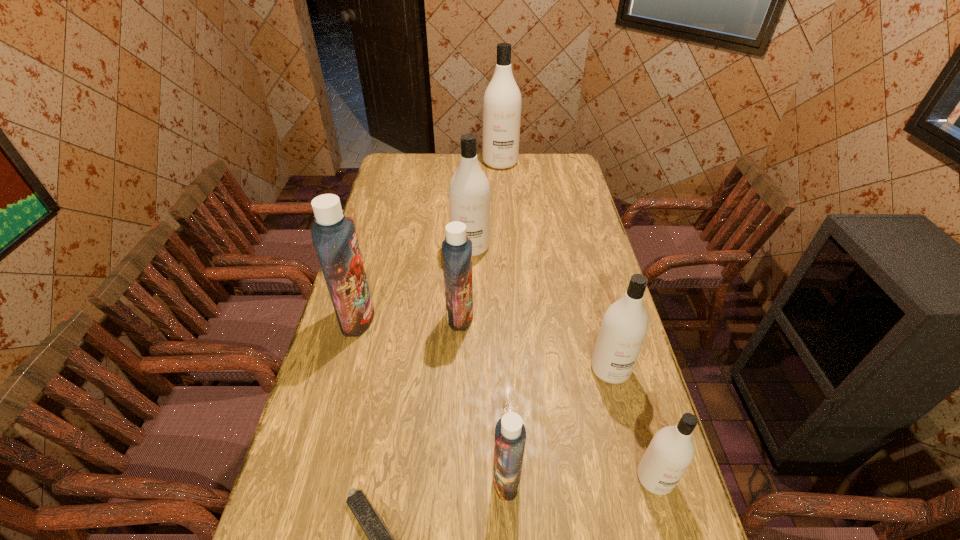
At what (x,y) coordinates should I click in order to perform the action: click on the second closest blue shampoo to the second biggest blue shampoo. Please return your answer as a coordinate pair (x, y). Looking at the image, I should click on (510, 434).

You are a GUI agent. You are given a task and a screenshot of the screen. Output one action in this format:
    pyautogui.click(x=<x>, y=<y>)
    Task: Click on the vacant space that satisfies the following two spatial constraints: 1. on the front-facing side of the farthest white shampoo; 2. on the front label of the smallest blue shampoo
    
    Given the screenshot: What is the action you would take?
    522,480

Locate an element on the screen. This screenshot has height=540, width=960. vacant area that satisfies the following two spatial constraints: 1. on the front-facing side of the tallest shampoo; 2. on the front label of the nearest blue shampoo is located at coordinates (522, 480).